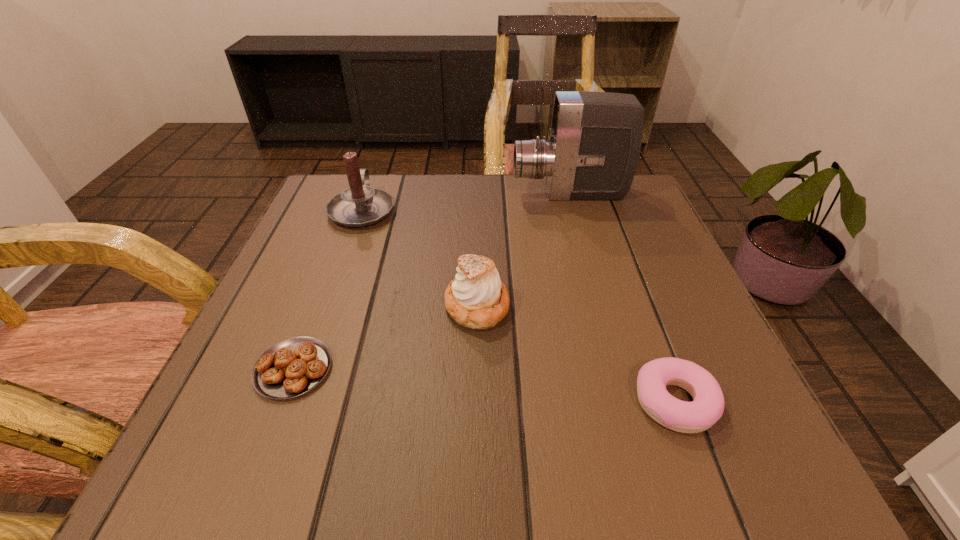
This screenshot has height=540, width=960. In order to click on free space at the right edge in this screenshot , I will do `click(597, 250)`.

You are a GUI agent. You are given a task and a screenshot of the screen. Output one action in this format:
    pyautogui.click(x=<x>, y=<y>)
    Task: Click on the free space at the far left corner
    
    Given the screenshot: What is the action you would take?
    pyautogui.click(x=326, y=191)

In the image, there is a desktop. Find the location of `vacant area at the near left corner`. vacant area at the near left corner is located at coordinates (295, 423).

Find the location of a particular element. vacant space at the near right corner of the desktop is located at coordinates (719, 423).

The image size is (960, 540). Identify the location of unoccupied area between the farthest pastry and the shortest pastry. (385, 338).

Locate an element on the screen. This screenshot has height=540, width=960. vacant area that lies between the third nearest object and the leftmost pastry is located at coordinates (385, 338).

You are a GUI agent. You are given a task and a screenshot of the screen. Output one action in this format:
    pyautogui.click(x=<x>, y=<y>)
    Task: Click on the free space between the candle and the tallest pastry
    The image size is (960, 540).
    Given the screenshot: What is the action you would take?
    pyautogui.click(x=420, y=258)

Identify the location of empty space that is in between the shortest object and the second shortest object. (484, 386).

The image size is (960, 540). Find the location of `vacant area that lies between the leftmost pastry and the second shortest object`. vacant area that lies between the leftmost pastry and the second shortest object is located at coordinates (484, 386).

Locate an element on the screen. free space between the third nearest object and the fourth shortest object is located at coordinates (420, 258).